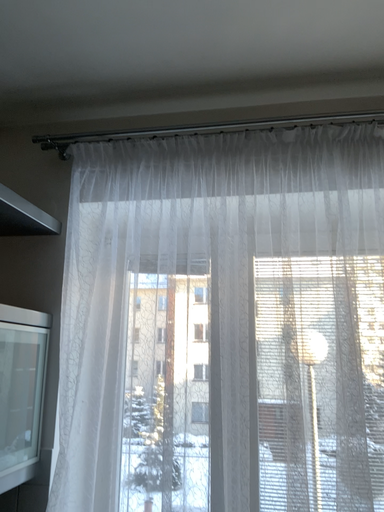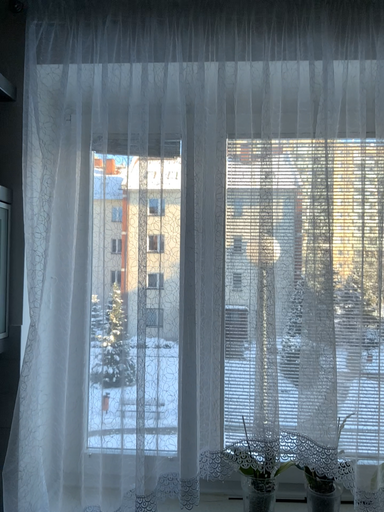
Question: Which way did the camera rotate in the video?

Choices:
 (A) rotated upward
 (B) rotated downward

Answer: (B)